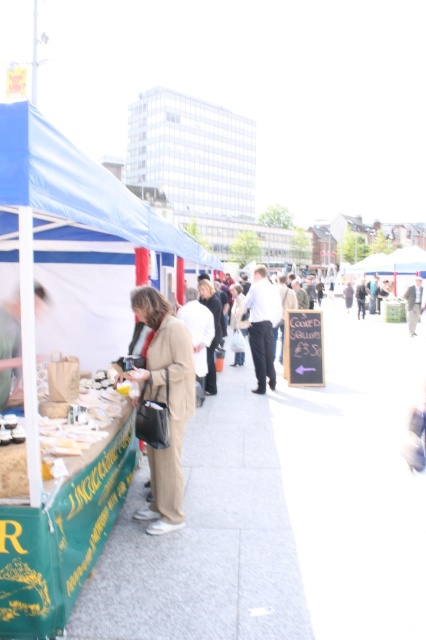
Does smooth concrete pavement at lower center have a lesser width compared to white fabric street vendor at center?

Incorrect, smooth concrete pavement at lower center's width is not less than white fabric street vendor at center's.

Does point (414, 616) lie behind point (258, 321)?

No, it is not.

The height and width of the screenshot is (640, 426). Find the location of `smooth concrete pavement at lower center`. smooth concrete pavement at lower center is located at coordinates (282, 512).

Can you confirm if smooth concrete pavement at lower center is thinner than beige fabric coat at center?

In fact, smooth concrete pavement at lower center might be wider than beige fabric coat at center.

Does smooth concrete pavement at lower center have a lesser height compared to beige fabric coat at center?

Indeed, smooth concrete pavement at lower center has a lesser height compared to beige fabric coat at center.

Locate an element on the screen. smooth concrete pavement at lower center is located at coordinates (282, 512).

Can you confirm if blue fabric canopy at left is smaller than white fabric street vendor at center?

Incorrect, blue fabric canopy at left is not smaller in size than white fabric street vendor at center.

Locate an element on the screen. blue fabric canopy at left is located at coordinates (77, 192).

Identify the location of blue fabric canopy at left. (77, 192).